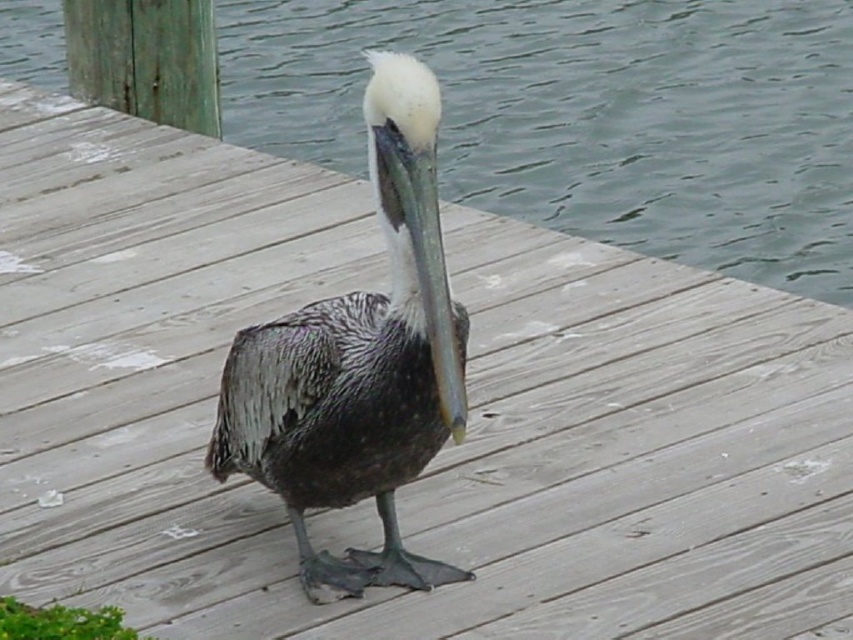
Question: Can you confirm if clear water at center is smaller than speckled feathered pelican at center?

Choices:
 (A) yes
 (B) no

Answer: (B)

Question: Among these points, which one is nearest to the camera?

Choices:
 (A) (711, 212)
 (B) (264, 332)

Answer: (B)

Question: Does clear water at center appear over speckled feathered pelican at center?

Choices:
 (A) no
 (B) yes

Answer: (B)

Question: Can you confirm if clear water at center is positioned below speckled feathered pelican at center?

Choices:
 (A) yes
 (B) no

Answer: (B)